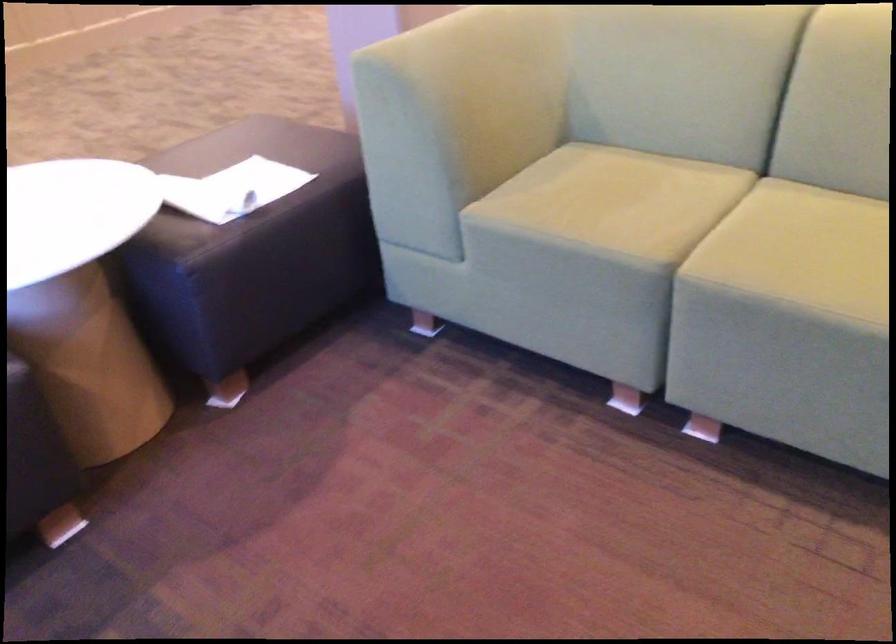
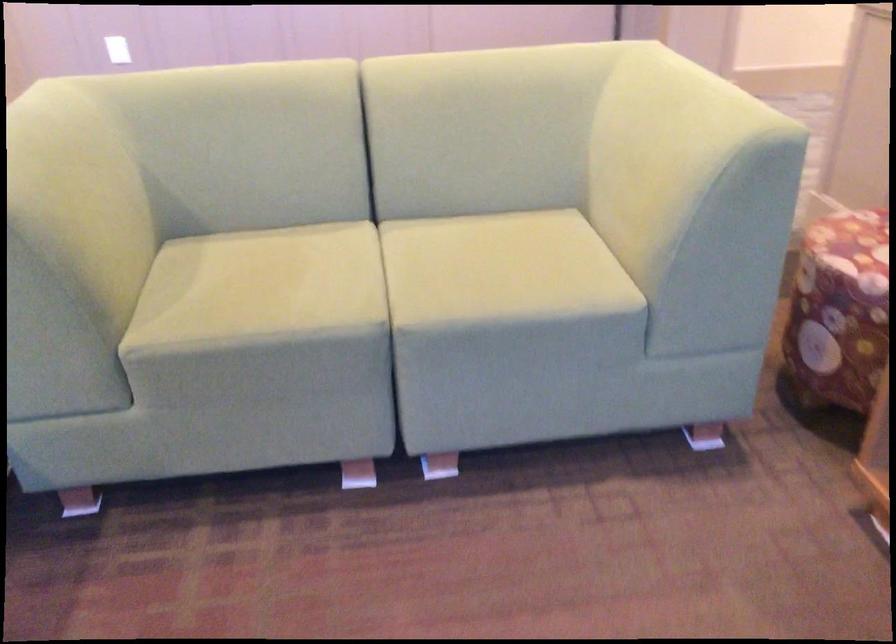
Question: How did the camera likely rotate?

Choices:
 (A) Left
 (B) Right
 (C) Up
 (D) Down

Answer: (B)